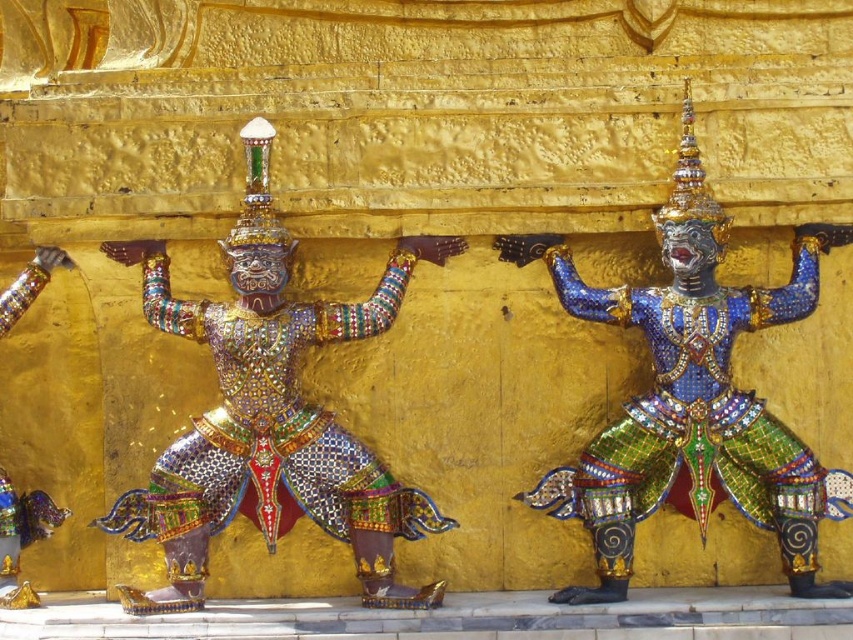
What is located at the coordinates point (x=270, y=413) in the image?

The point (x=270, y=413) indicates the location of the multicolored mosaic deity at center.

You are an art conservator tasked with moving the multicolored mosaic deity at center and the shiny gold armor at left into a storage room. The doorway to the storage room is 1.2 meters wide. Can both objects fit through the doorway side by side without rotating them?

The multicolored mosaic deity at center is wider than the shiny gold armor at left. Since the doorway is 1.2 meters wide, it depends on their exact widths. However, without specific measurements, we cannot confirm if their combined width exceeds the doorway. Further measurements are needed.